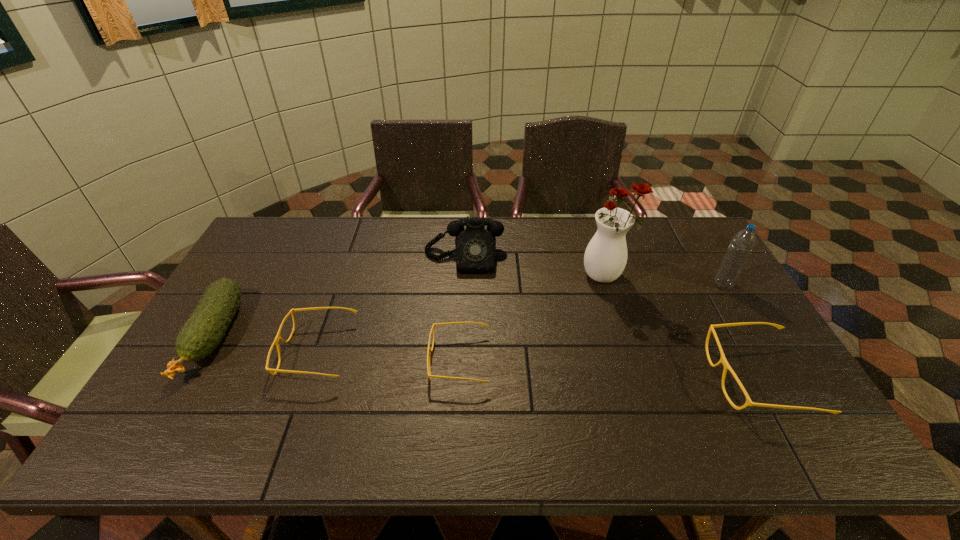
At what (x,y) coordinates should I click in order to perform the action: click on unoccupied position between the rightmost spectacles and the cucumber. Please return your answer as a coordinate pair (x, y). Looking at the image, I should click on (486, 357).

Identify the location of vacant region between the rightmost spectacles and the cucumber. (486, 357).

Locate an element on the screen. Image resolution: width=960 pixels, height=540 pixels. free space between the telephone and the fifth object from left to right is located at coordinates (534, 267).

In order to click on object that can be found as the fifth closest to the fourth tallest object in this screenshot , I will do `click(722, 360)`.

Select which object is the sixth closest to the sixth shortest object. Please provide its 2D coordinates. Your answer should be formatted as a tuple, i.e. [(x, y)], where the tuple contains the x and y coordinates of a point satisfying the conditions above.

[(203, 331)]

Point out which spectacles is positioned as the nearest to the fourth shortest object. Please provide its 2D coordinates. Your answer should be formatted as a tuple, i.e. [(x, y)], where the tuple contains the x and y coordinates of a point satisfying the conditions above.

[(278, 336)]

Locate which spectacles ranks in proximity to the shortest spectacles. Please provide its 2D coordinates. Your answer should be formatted as a tuple, i.e. [(x, y)], where the tuple contains the x and y coordinates of a point satisfying the conditions above.

[(278, 336)]

Locate an element on the screen. The image size is (960, 540). vacant area that satisfies the following two spatial constraints: 1. on the dial of the water bottle; 2. on the right side of the fifth shortest object is located at coordinates (463, 285).

The height and width of the screenshot is (540, 960). I want to click on free location that satisfies the following two spatial constraints: 1. on the front side of the second tallest object; 2. on the left side of the third object from right to left, so click(x=607, y=285).

What are the coordinates of `vacant point that satisfies the following two spatial constraints: 1. on the dial of the third tallest object; 2. in front of the lenses of the sixth tallest object` in the screenshot? It's located at (460, 352).